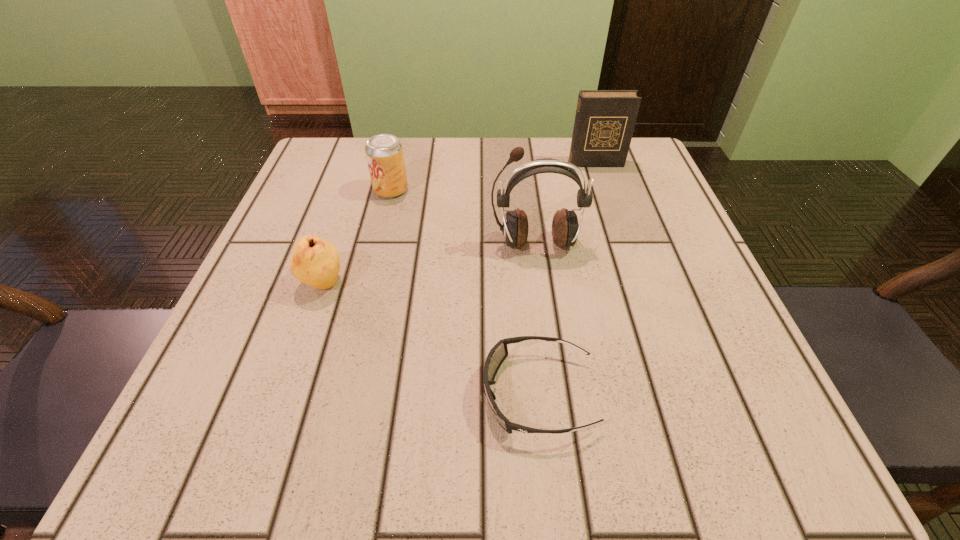
Where is `vacant space at the far right corner of the desktop`? This screenshot has height=540, width=960. vacant space at the far right corner of the desktop is located at coordinates (651, 176).

You are a GUI agent. You are given a task and a screenshot of the screen. Output one action in this format:
    pyautogui.click(x=<x>, y=<y>)
    Task: Click on the free space between the nearest object and the leftmost object
    
    Given the screenshot: What is the action you would take?
    pyautogui.click(x=430, y=339)

Where is `free space between the second tallest object and the shortest object`? free space between the second tallest object and the shortest object is located at coordinates (566, 279).

Where is `vacant space in between the third nearest object and the pop (soda)`? vacant space in between the third nearest object and the pop (soda) is located at coordinates (464, 217).

Locate an element on the screen. empty space between the second tallest object and the shortest object is located at coordinates (566, 279).

Where is `vacant space that is in between the pear and the rightmost object`? vacant space that is in between the pear and the rightmost object is located at coordinates (459, 224).

You are a GUI agent. You are given a task and a screenshot of the screen. Output one action in this format:
    pyautogui.click(x=<x>, y=<y>)
    Task: Click on the free point between the earphone and the nearest object
    The width and height of the screenshot is (960, 540).
    Given the screenshot: What is the action you would take?
    pyautogui.click(x=537, y=319)

At what (x,y) coordinates should I click in order to perform the action: click on vacant region between the earphone and the rightmost object. Please return your answer as a coordinate pair (x, y). Looking at the image, I should click on (565, 204).

You are a GUI agent. You are given a task and a screenshot of the screen. Output one action in this format:
    pyautogui.click(x=<x>, y=<y>)
    Task: Click on the vacant area that lies between the pop (soda) and the leftmost object
    The image size is (960, 540).
    Given the screenshot: What is the action you would take?
    pyautogui.click(x=357, y=237)

You are a GUI agent. You are given a task and a screenshot of the screen. Output one action in this format:
    pyautogui.click(x=<x>, y=<y>)
    Task: Click on the vacant area between the nearest object and the leftmost object
    This screenshot has height=540, width=960.
    Given the screenshot: What is the action you would take?
    click(x=430, y=339)